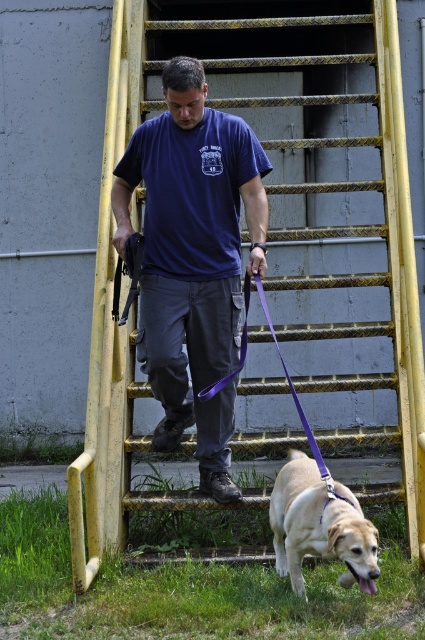
Question: Which of the following is the closest to the observer?

Choices:
 (A) golden fur dog at lower center
 (B) blue cotton shirt at center
 (C) yellow metallic ladder at center

Answer: (A)

Question: Which of the following is the farthest from the observer?

Choices:
 (A) (229, 184)
 (B) (362, 193)

Answer: (B)

Question: Which point is closer to the camera?

Choices:
 (A) (218, 465)
 (B) (319, 93)
 (C) (362, 522)

Answer: (C)

Question: Is yellow metallic ladder at center thinner than golden fur dog at lower center?

Choices:
 (A) yes
 (B) no

Answer: (B)

Question: Observing the image, what is the correct spatial positioning of yellow metallic ladder at center in reference to blue cotton shirt at center?

Choices:
 (A) left
 (B) right

Answer: (B)

Question: Is yellow metallic ladder at center below golden fur dog at lower center?

Choices:
 (A) yes
 (B) no

Answer: (B)